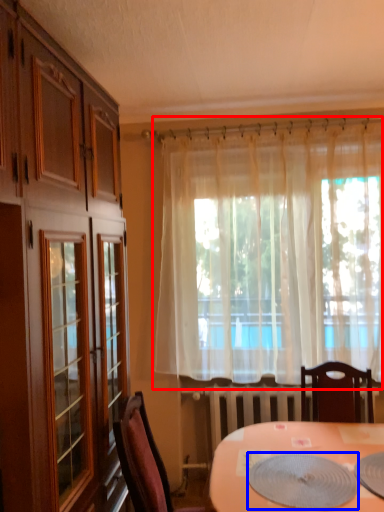
Question: Which point is further to the camera, curtain (highlighted by a red box) or platter (highlighted by a blue box)?

Choices:
 (A) curtain
 (B) platter

Answer: (A)